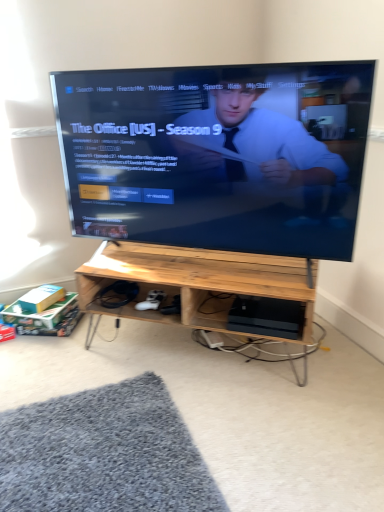
Where is `free spot below black glossy tv at center (from a real-world perspective)`? The image size is (384, 512). free spot below black glossy tv at center (from a real-world perspective) is located at coordinates (191, 265).